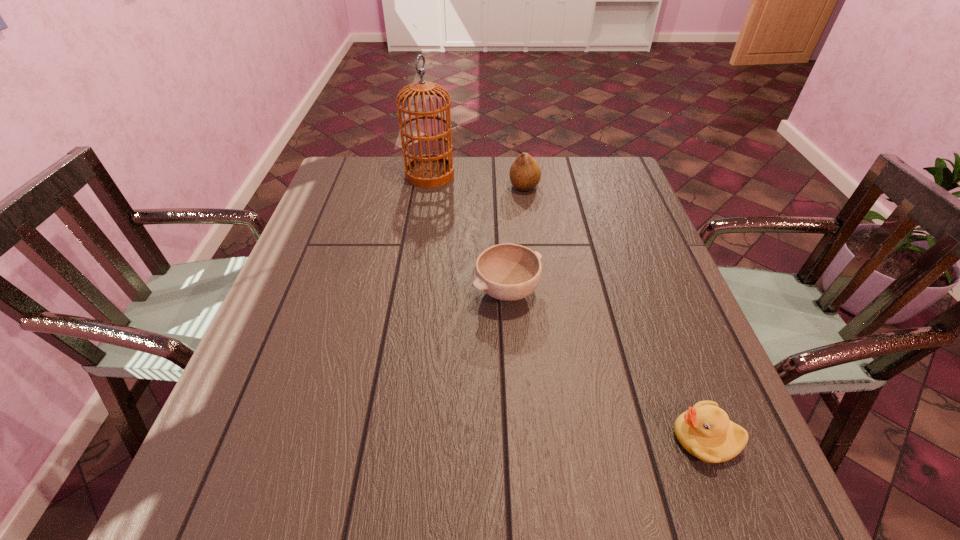
Locate an element on the screen. vacant position located at the face of the nearest object is located at coordinates (599, 438).

Where is `vacant space situated at the face of the nearest object`? vacant space situated at the face of the nearest object is located at coordinates (507, 438).

Where is `birdcage that is positioned at the far edge`? birdcage that is positioned at the far edge is located at coordinates (430, 170).

I want to click on pear present at the far edge, so click(525, 173).

Where is `object that is at the near edge`? object that is at the near edge is located at coordinates (705, 431).

Find the location of a particular element. Image resolution: width=960 pixels, height=540 pixels. object positioned at the right edge is located at coordinates (705, 431).

The width and height of the screenshot is (960, 540). In order to click on object present at the near right corner in this screenshot , I will do `click(705, 431)`.

Image resolution: width=960 pixels, height=540 pixels. I want to click on vacant space at the far edge, so click(572, 194).

You are a GUI agent. You are given a task and a screenshot of the screen. Output one action in this format:
    pyautogui.click(x=<x>, y=<y>)
    Task: Click on the vacant space at the near edge of the desktop
    Image resolution: width=960 pixels, height=540 pixels.
    Given the screenshot: What is the action you would take?
    pyautogui.click(x=347, y=515)

Locate an element on the screen. The image size is (960, 540). vacant space at the left edge of the desktop is located at coordinates (349, 217).